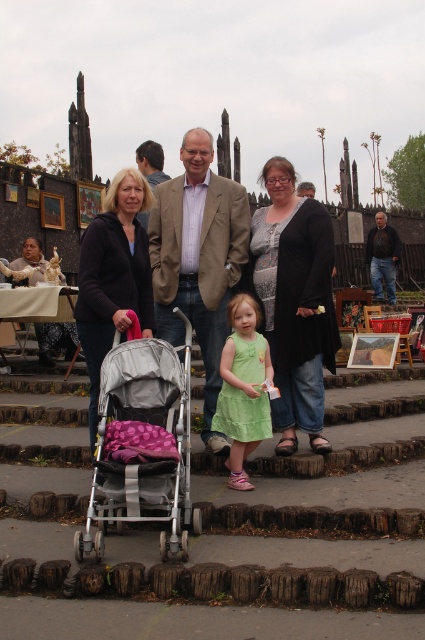
You are standing at the location of point (314, 189) and want to walk to the location of point (220, 372). Is there a clear path between these two points?

Yes, since point (220, 372) is in front of point (314, 189), there is a clear path between them.

You are a photographer trying to capture a clear shot of the beige textured blazer at center without the silver metallic stroller at center blocking it. What should you do?

Move your position so that the beige textured blazer at center is no longer behind the silver metallic stroller at center, since the silver metallic stroller at center is currently in front of it.